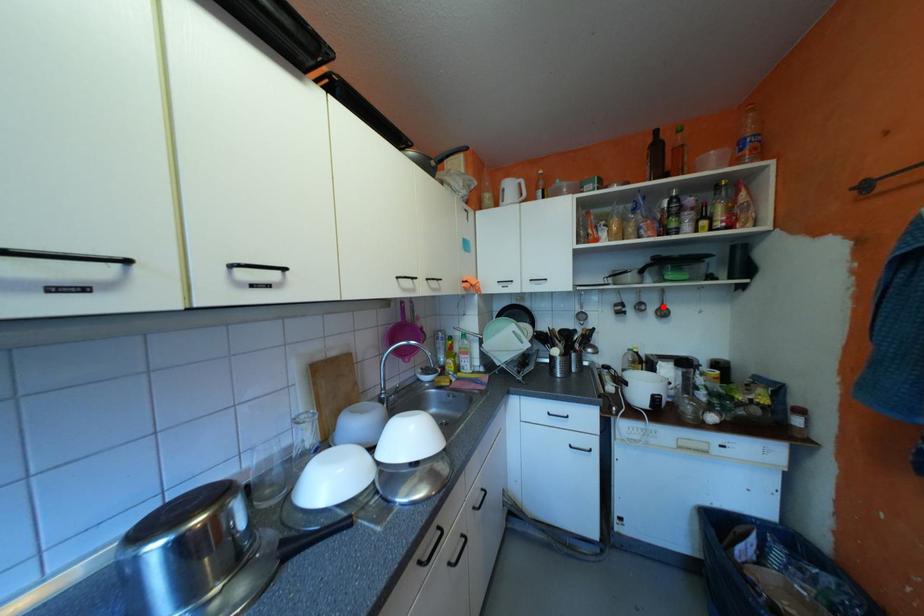
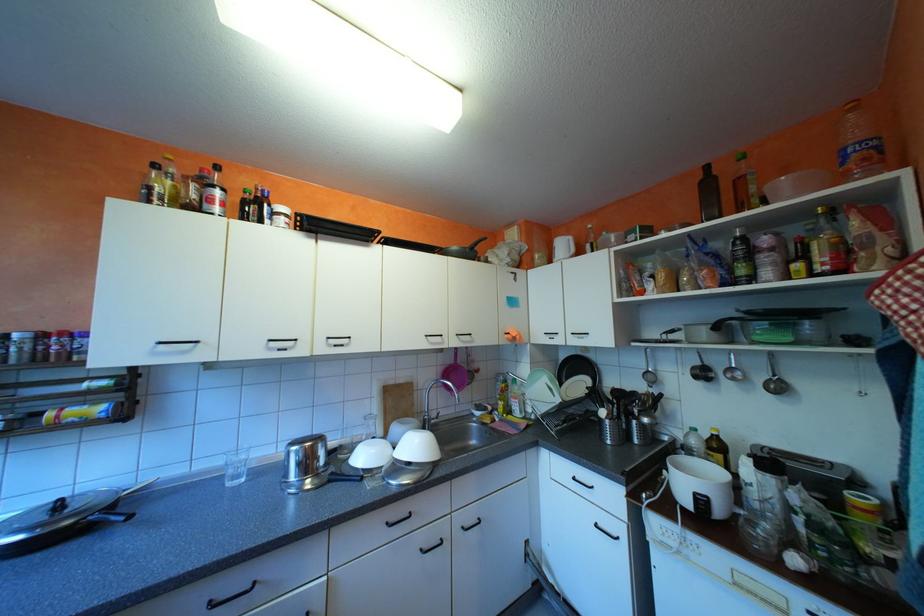
Question: I am providing you with two images of the same scene from different viewpoints. A red point is marked on the first image. At the location where the point appears in image 1, is it still visible in image 2?

Choices:
 (A) Yes
 (B) No

Answer: (A)